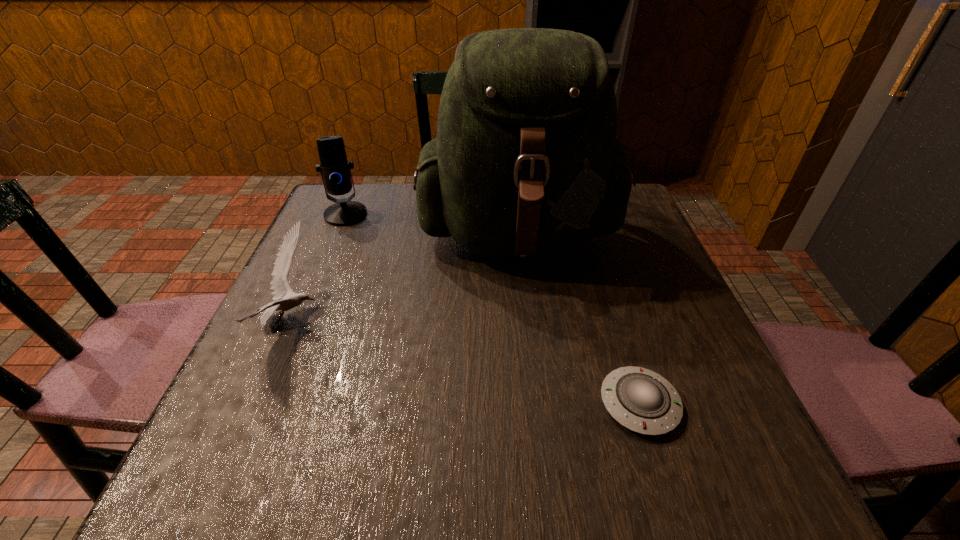
What are the coordinates of `free space at the far left corner of the desktop` in the screenshot? It's located at (365, 220).

Find the location of a particular element. free space at the far right corner of the desktop is located at coordinates (626, 222).

In the image, there is a desktop. Identify the location of free space at the near right corner. The image size is (960, 540). (729, 441).

Identify the location of unoccupied position between the backpack and the shortest object. This screenshot has height=540, width=960. (580, 319).

Where is `free space between the gull and the microphone`? free space between the gull and the microphone is located at coordinates (319, 267).

The image size is (960, 540). Identify the location of vacant area that lies between the tallest object and the second shortest object. (406, 277).

At what (x,y) coordinates should I click in order to perform the action: click on unoccupied position between the saucer and the tallest object. Please return your answer as a coordinate pair (x, y). Image resolution: width=960 pixels, height=540 pixels. Looking at the image, I should click on point(580,319).

Where is `vacant space in between the tallest object and the second shortest object`? The image size is (960, 540). vacant space in between the tallest object and the second shortest object is located at coordinates (406, 277).

The image size is (960, 540). In order to click on empty space that is in between the shortest object and the third shortest object in this screenshot , I will do `click(492, 309)`.

Where is `free space between the shortest object and the third shortest object`? free space between the shortest object and the third shortest object is located at coordinates (492, 309).